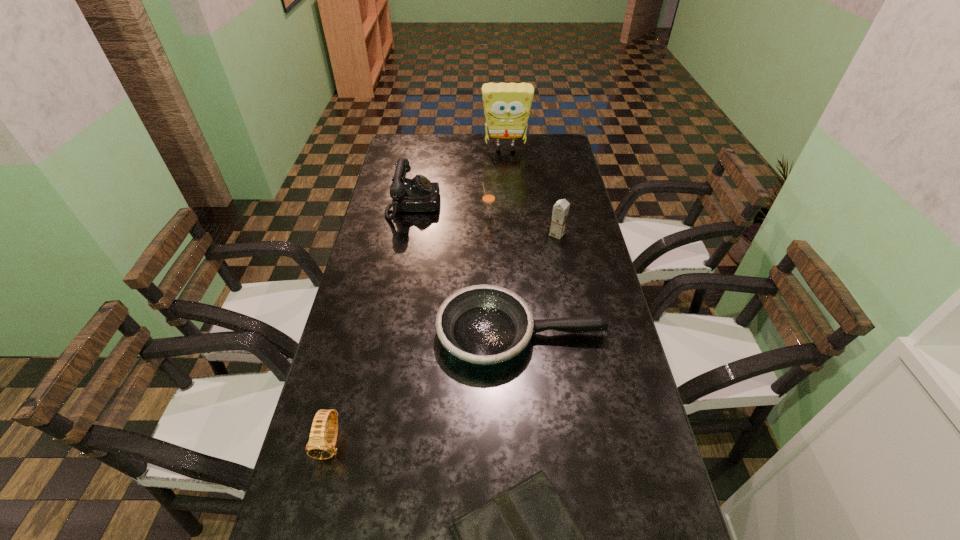
The image size is (960, 540). Identify the location of free space located on the back of the straw. pyautogui.click(x=487, y=165).

This screenshot has height=540, width=960. Find the location of `vacant space located 0.270m on the front of the fourth nearest object`. vacant space located 0.270m on the front of the fourth nearest object is located at coordinates point(569,298).

Find the location of a particular element. Image resolution: width=960 pixels, height=540 pixels. vacant space situated on the face of the second nearest object is located at coordinates (315, 508).

Locate an element on the screen. The image size is (960, 540). object that is positioned at the far edge is located at coordinates 507,106.

Locate an element on the screen. The height and width of the screenshot is (540, 960). telephone positioned at the left edge is located at coordinates (418, 194).

I want to click on watch that is positioned at the left edge, so tap(320, 448).

Locate an element on the screen. This screenshot has width=960, height=540. chocolate milk located at the right edge is located at coordinates (560, 211).

You are a GUI agent. You are given a task and a screenshot of the screen. Output one action in this format:
    pyautogui.click(x=<x>, y=<y>)
    Task: Click on the frying pan located in the right edge section of the desktop
    The image size is (960, 540).
    Given the screenshot: What is the action you would take?
    pyautogui.click(x=484, y=324)

Where is `vacant space at the left edge`? vacant space at the left edge is located at coordinates (407, 245).

I want to click on free space at the right edge, so click(564, 305).